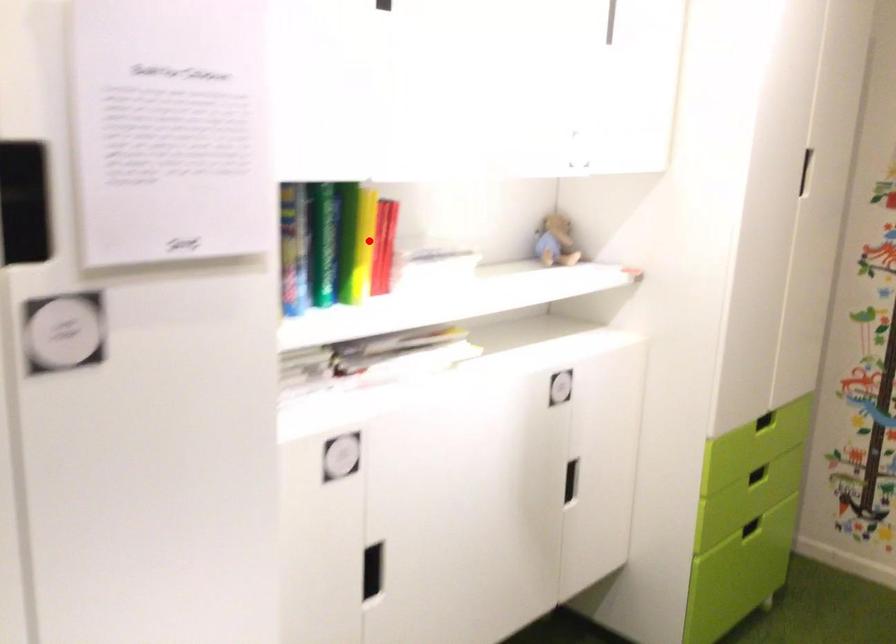
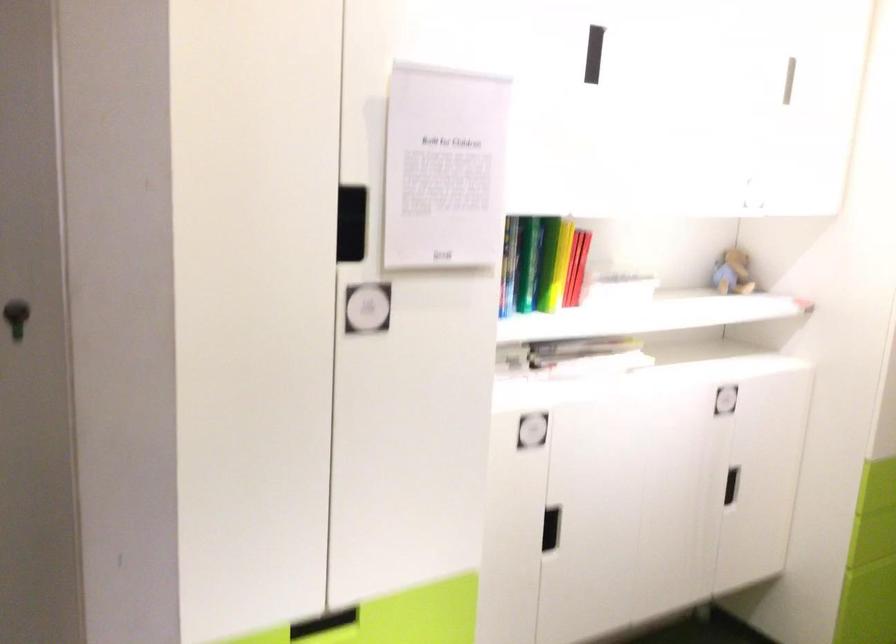
Question: I am providing you with two images of the same scene from different viewpoints. Given a red point in image1, look at the same physical point in image2. Is it:

Choices:
 (A) Closer to the viewpoint
 (B) Farther from the viewpoint

Answer: (B)